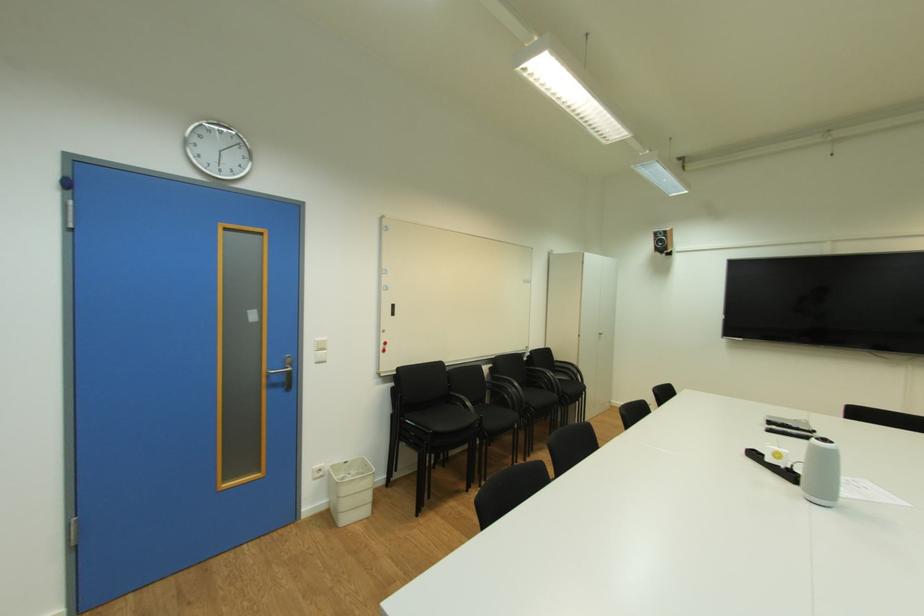
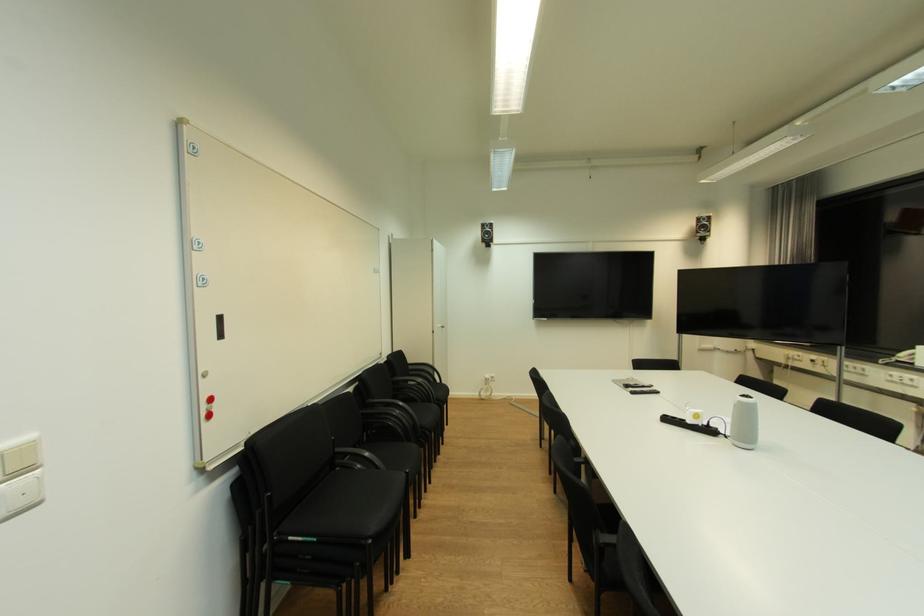
The point at (x=326, y=361) is marked in the first image. Where is the corresponding point in the second image?

(26, 505)